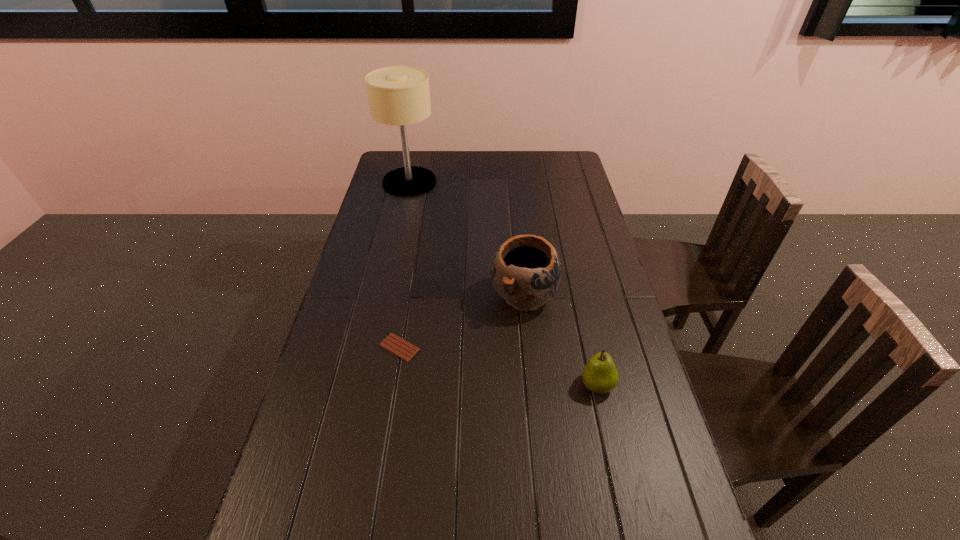
The height and width of the screenshot is (540, 960). Find the location of `the farthest object`. the farthest object is located at coordinates (398, 95).

What are the coordinates of `table lamp` in the screenshot? It's located at (398, 95).

This screenshot has width=960, height=540. What are the coordinates of `pottery` in the screenshot? It's located at (526, 272).

Identify the location of the third nearest object. This screenshot has height=540, width=960. (526, 272).

The width and height of the screenshot is (960, 540). Identify the location of the third tallest object. (599, 375).

You are a GUI agent. You are given a task and a screenshot of the screen. Output one action in this format:
    pyautogui.click(x=<x>, y=<y>)
    Task: Click on the pear
    This screenshot has height=540, width=960.
    Given the screenshot: What is the action you would take?
    pyautogui.click(x=599, y=375)

Find the location of a particular element. This screenshot has width=960, height=540. the third farthest object is located at coordinates pos(392,343).

Where is `the shortest object`? The image size is (960, 540). the shortest object is located at coordinates pos(392,343).

I want to click on vacant space located on the front of the table lamp, so click(404, 207).

Where is `free location located on the front of the third shortest object`? free location located on the front of the third shortest object is located at coordinates (536, 413).